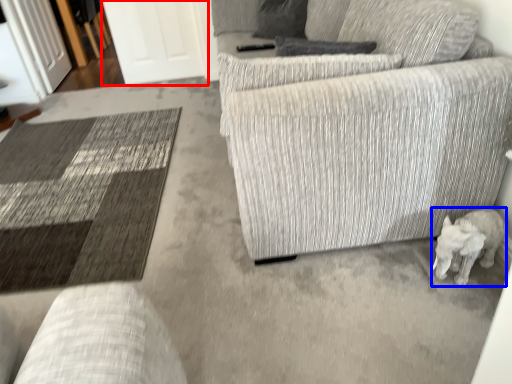
Question: Which of the following is the closest to the observer, glass door (highlighted by a red box) or animal (highlighted by a blue box)?

Choices:
 (A) glass door
 (B) animal

Answer: (B)